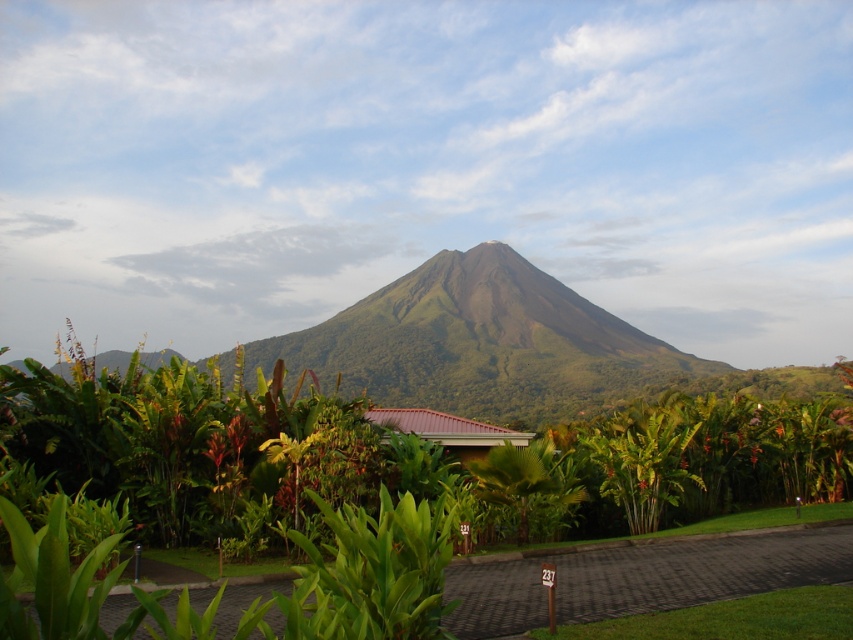
Question: Which point appears farthest from the camera in this image?

Choices:
 (A) (515, 456)
 (B) (126, 417)

Answer: (A)

Question: Does green leafy tree at center appear on the left side of green leafy palm tree at center?

Choices:
 (A) yes
 (B) no

Answer: (A)

Question: Is green leafy tree at center wider than green leafy palm tree at center?

Choices:
 (A) yes
 (B) no

Answer: (A)

Question: Does green leafy tree at center have a larger size compared to green leafy palm tree at center?

Choices:
 (A) no
 (B) yes

Answer: (B)